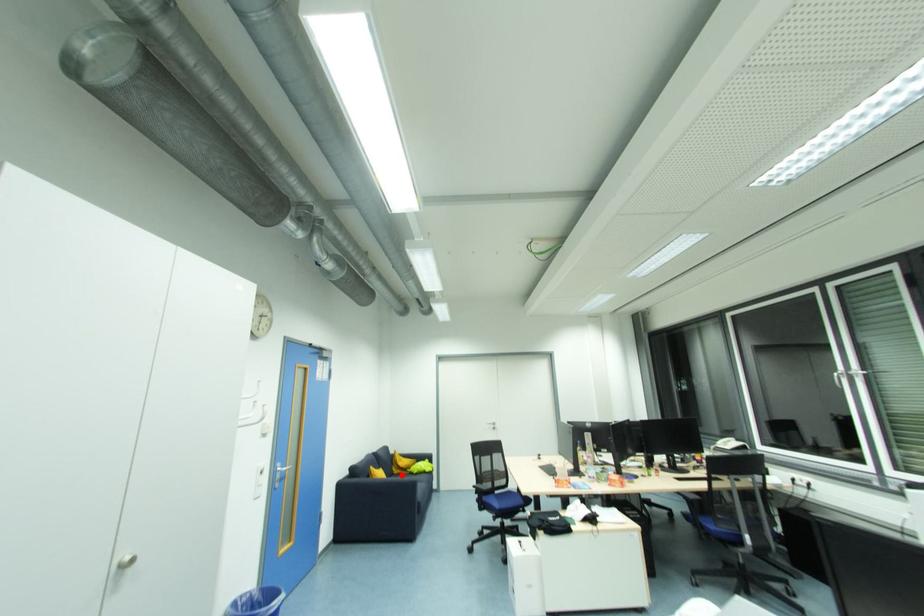
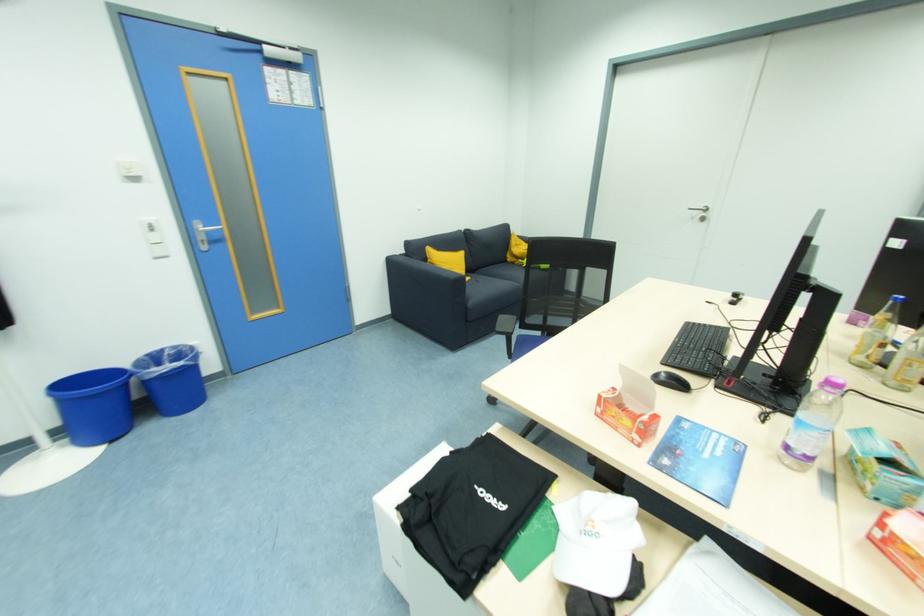
In the second image, find the point that corresponds to the highlighted location in the first image.

(516, 265)